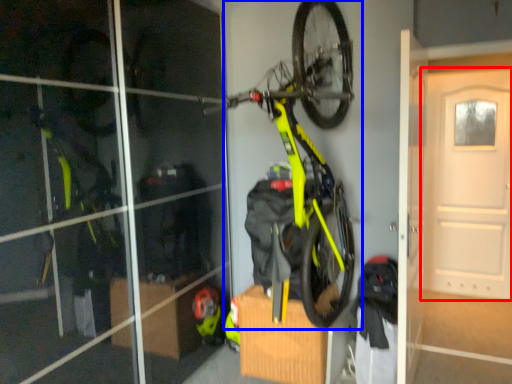
Question: Which object appears closest to the camera in this image, door (highlighted by a red box) or bicycle (highlighted by a blue box)?

Choices:
 (A) door
 (B) bicycle

Answer: (B)